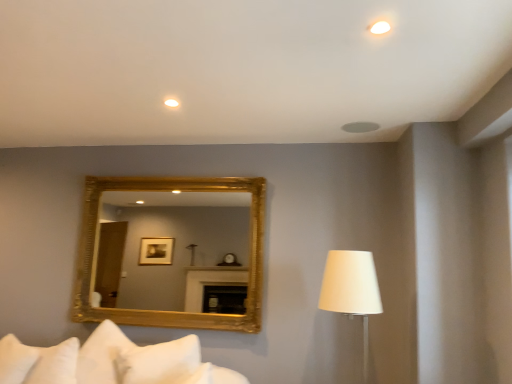
Question: Considering the positions of white soft pillow at lower left, which ranks as the second pillow in right-to-left order, and white fabric lampshade at right in the image, is white soft pillow at lower left, which ranks as the second pillow in right-to-left order, wider or thinner than white fabric lampshade at right?

Choices:
 (A) wide
 (B) thin

Answer: (B)

Question: Which is correct: white soft pillow at lower left, which ranks as the second pillow in right-to-left order, is inside white fabric lampshade at right, or outside of it?

Choices:
 (A) outside
 (B) inside

Answer: (A)

Question: Based on their relative distances, which object is farther from the white fabric lampshade at right?

Choices:
 (A) gold/gilded mirror at center
 (B) white soft pillow at lower left, which appears as the 2th pillow when viewed from the left
 (C) white matte ceiling light at upper center, the 2th lighting from the top
 (D) white soft pillow at lower left, which is counted as the 1th pillow, starting from the left
 (E) white matte ceiling light at upper center, the 1th lighting positioned from the top

Answer: (A)

Question: Based on their relative distances, which object is nearer to the white matte ceiling light at upper center, the first lighting when ordered from right to left?

Choices:
 (A) white soft pillow at lower left, which ranks as the second pillow in right-to-left order
 (B) gold/gilded mirror at center
 (C) white soft pillow at lower left, which appears as the 2th pillow when viewed from the left
 (D) white fabric lampshade at right
 (E) white matte ceiling light at upper center, positioned as the first lighting in back-to-front order

Answer: (E)